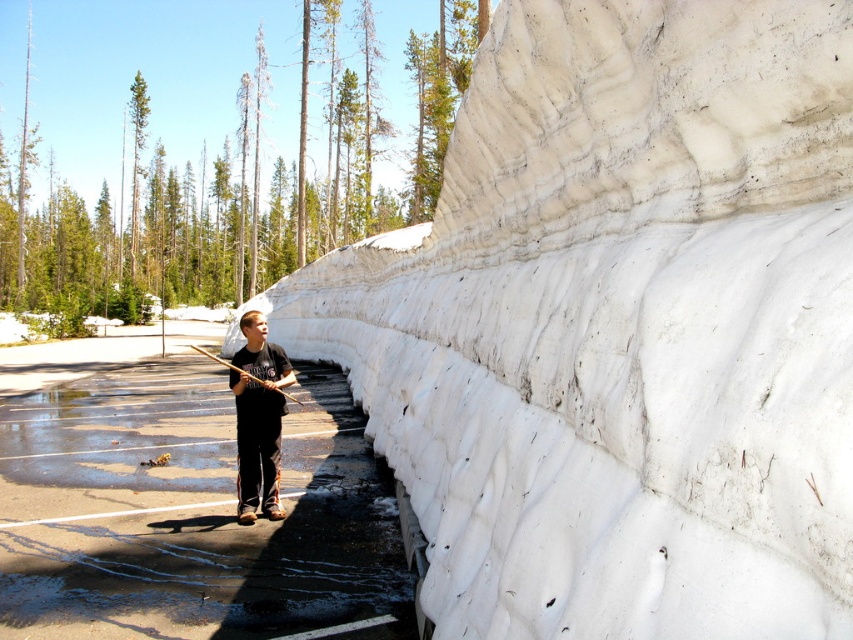
Question: Which point is closer to the camera?

Choices:
 (A) [614, 474]
 (B) [277, 497]
 (C) [223, 358]

Answer: (A)

Question: Where is dark gray cotton shirt at center located in relation to wooden fishing pole at center in the image?

Choices:
 (A) below
 (B) above

Answer: (A)

Question: Which object is positioned closest to the wooden fishing pole at center?

Choices:
 (A) white fluffy snow at center
 (B) dark gray cotton shirt at center

Answer: (B)

Question: Is white fluffy snow at center wider than wooden fishing pole at center?

Choices:
 (A) yes
 (B) no

Answer: (B)

Question: Where is white fluffy snow at center located in relation to wooden fishing pole at center in the image?

Choices:
 (A) above
 (B) below

Answer: (A)

Question: Among these points, which one is nearest to the camera?

Choices:
 (A) (326, 349)
 (B) (270, 490)

Answer: (B)